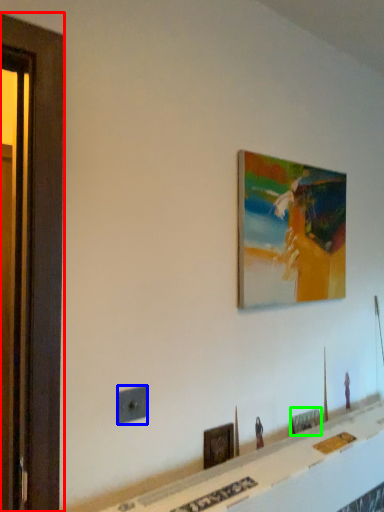
Question: Based on their relative distances, which object is nearer to screen door (highlighted by a red box)? Choose from electric outlet (highlighted by a blue box) and picture frame (highlighted by a green box).

Choices:
 (A) electric outlet
 (B) picture frame

Answer: (A)